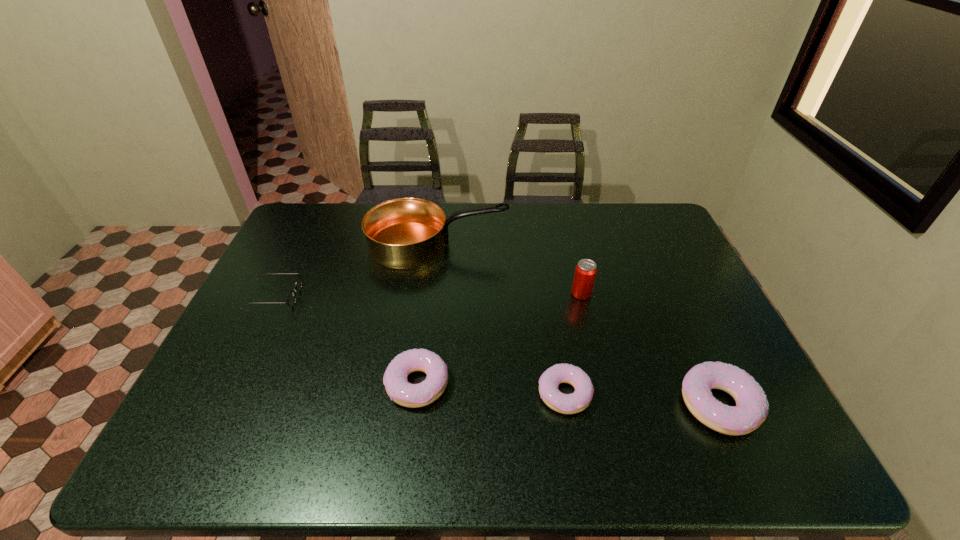
Considering the uniform spacing of doughnuts, where should an additional doughnut be positioned on the left? Please locate a free spot. Please provide its 2D coordinates. Your answer should be formatted as a tuple, i.e. [(x, y)], where the tuple contains the x and y coordinates of a point satisfying the conditions above.

[(275, 374)]